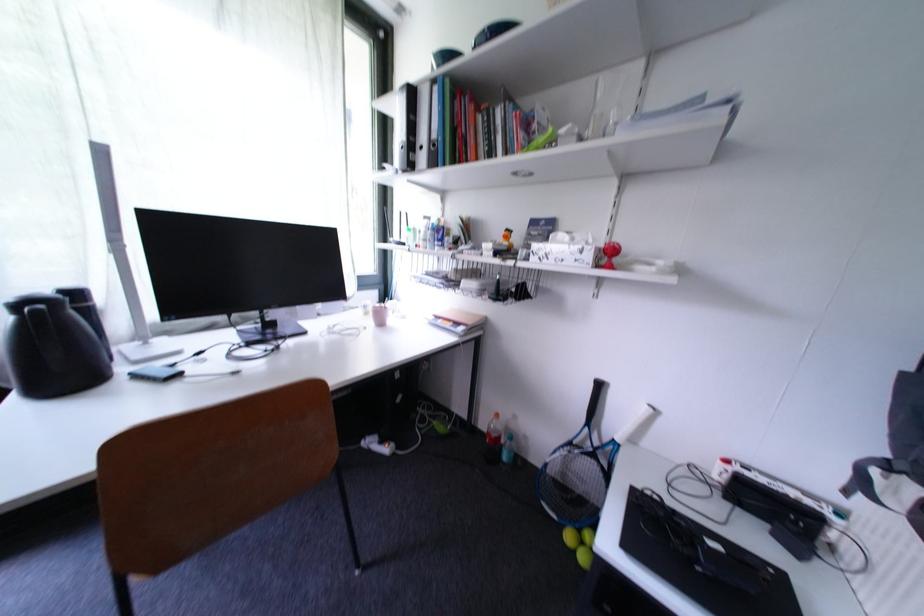
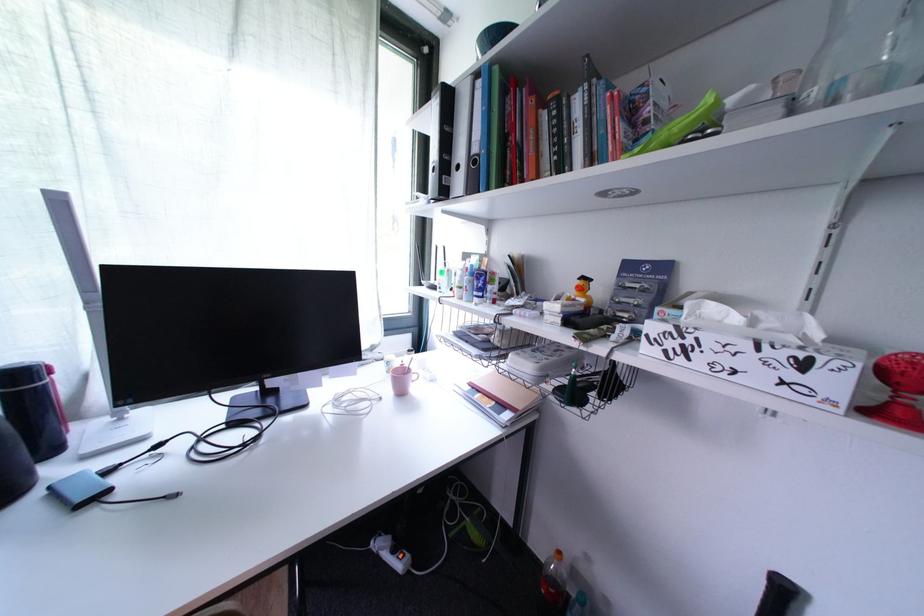
Locate, in the second image, the point that corresponds to point 388,446 in the first image.

(402, 553)